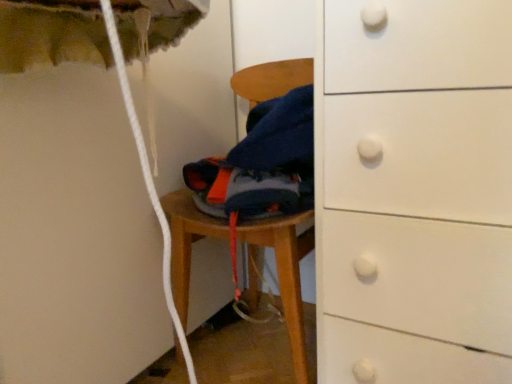
What is the approximate width of white matte chest of drawers at right?

It is 43.83 centimeters.

What do you see at coordinates (414, 192) in the screenshot?
I see `white matte chest of drawers at right` at bounding box center [414, 192].

Measure the distance between white matte chest of drawers at right and camera.

white matte chest of drawers at right and camera are 23.37 inches apart.

This screenshot has width=512, height=384. I want to click on white matte chest of drawers at right, so click(x=414, y=192).

Image resolution: width=512 pixels, height=384 pixels. In order to click on white matte chest of drawers at right in this screenshot , I will do `click(414, 192)`.